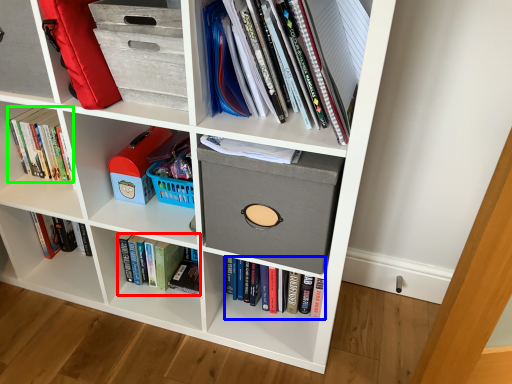
Question: Based on their relative distances, which object is nearer to book (highlighted by a red box)? Choose from book (highlighted by a blue box) and book (highlighted by a green box).

Choices:
 (A) book
 (B) book

Answer: (A)